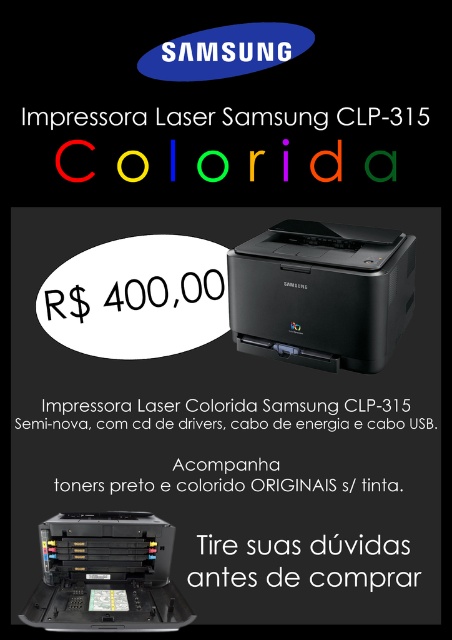
Who is positioned more to the right, matte black printer at lower center or matte black printer at center?

matte black printer at center

Is matte black printer at lower center positioned behind matte black printer at center?

No, matte black printer at lower center is closer to the viewer.

The height and width of the screenshot is (640, 452). Describe the element at coordinates (106, 573) in the screenshot. I see `matte black printer at lower center` at that location.

This screenshot has height=640, width=452. In order to click on matte black printer at lower center in this screenshot , I will do `click(106, 573)`.

Can you confirm if black plastic printer at center is positioned to the left of matte black printer at lower center?

Incorrect, black plastic printer at center is not on the left side of matte black printer at lower center.

Between black plastic printer at center and matte black printer at lower center, which one is positioned lower?

matte black printer at lower center is below.

The height and width of the screenshot is (640, 452). Identify the location of black plastic printer at center. (321, 292).

Is matte black printer at center to the right of colorida plastic impressora laser at center from the viewer's perspective?

Yes, matte black printer at center is to the right of colorida plastic impressora laser at center.

Is matte black printer at center taller than colorida plastic impressora laser at center?

No.

Where is `matte black printer at center`? The width and height of the screenshot is (452, 640). matte black printer at center is located at coordinates (241, 116).